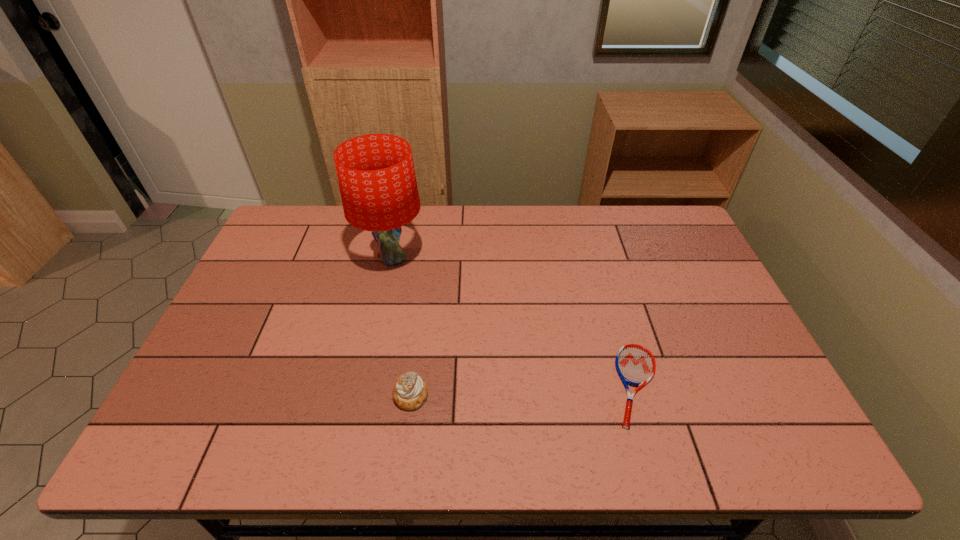
Identify the location of free location that satisfies the following two spatial constraints: 1. on the front-facing side of the shortest object; 2. on the left side of the lampshade. The width and height of the screenshot is (960, 540). (365, 385).

You are a GUI agent. You are given a task and a screenshot of the screen. Output one action in this format:
    pyautogui.click(x=<x>, y=<y>)
    Task: Click on the free space that satisfies the following two spatial constraints: 1. on the front-facing side of the second shortest object; 2. on the left side of the farthest object
    This screenshot has width=960, height=540.
    Given the screenshot: What is the action you would take?
    pyautogui.click(x=362, y=395)